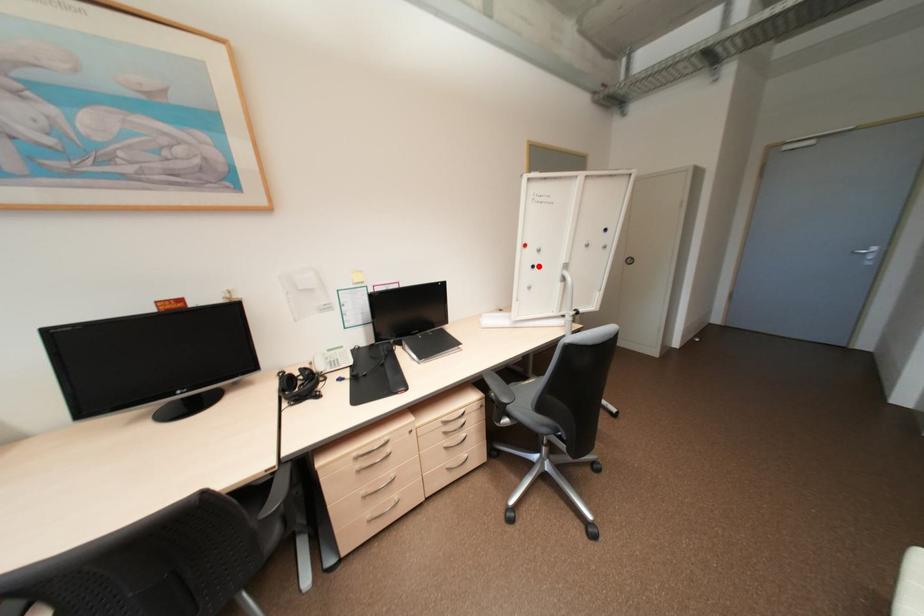
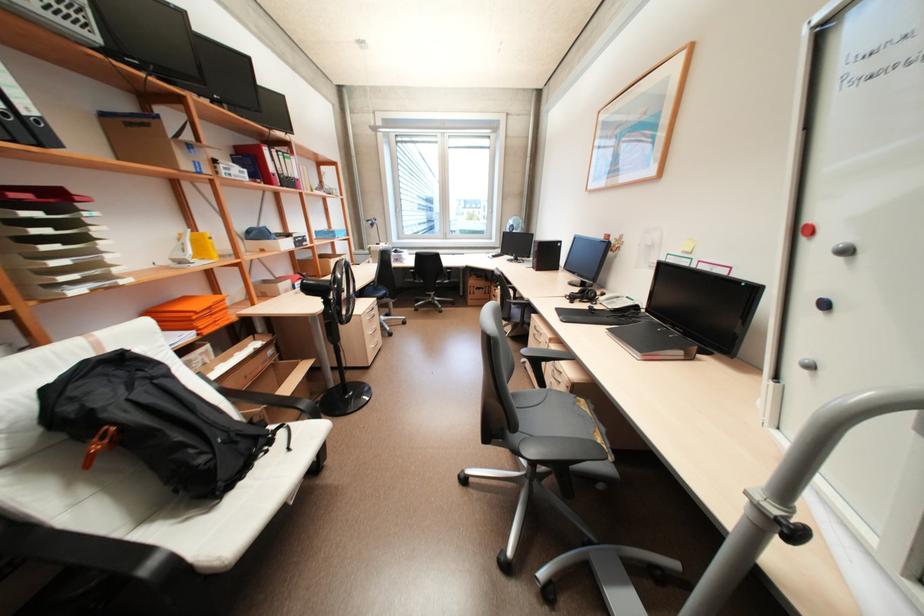
In the second image, find the point that corresponds to the highlighted location in the first image.

(830, 304)